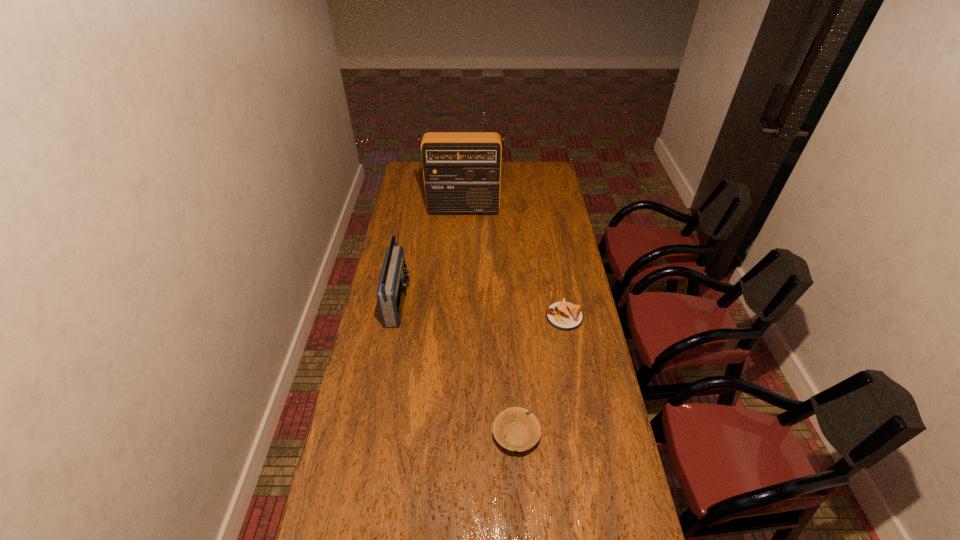
Identify the location of free space that is in between the second tallest object and the tallest object. The image size is (960, 540). (431, 256).

At what (x,y) coordinates should I click in order to perform the action: click on free area in between the shorter radio receiver and the taller radio receiver. Please return your answer as a coordinate pair (x, y). Looking at the image, I should click on click(x=431, y=256).

Locate an element on the screen. The height and width of the screenshot is (540, 960). empty location between the rightmost object and the second tallest object is located at coordinates (481, 309).

Locate an element on the screen. The width and height of the screenshot is (960, 540). empty space between the shorter radio receiver and the farther radio receiver is located at coordinates (431, 256).

The width and height of the screenshot is (960, 540). In order to click on the closest object to the right radio receiver in this screenshot , I will do `click(392, 287)`.

The height and width of the screenshot is (540, 960). I want to click on the third closest object to the farther radio receiver, so click(x=520, y=427).

Where is `free spot that satisfies the following two spatial constraints: 1. on the front-facing side of the bowl; 2. on the left side of the farther radio receiver`? free spot that satisfies the following two spatial constraints: 1. on the front-facing side of the bowl; 2. on the left side of the farther radio receiver is located at coordinates (453, 435).

Image resolution: width=960 pixels, height=540 pixels. What are the coordinates of `free space that satisfies the following two spatial constraints: 1. on the front panel of the sandwich; 2. on the right side of the left radio receiver` in the screenshot? It's located at (396, 316).

Find the location of `free space that satisfies the following two spatial constraints: 1. on the front panel of the nearest object; 2. on the left side of the left radio receiver`. free space that satisfies the following two spatial constraints: 1. on the front panel of the nearest object; 2. on the left side of the left radio receiver is located at coordinates (374, 435).

The height and width of the screenshot is (540, 960). I want to click on free space that satisfies the following two spatial constraints: 1. on the front panel of the shorter radio receiver; 2. on the left side of the rightmost object, so click(x=396, y=316).